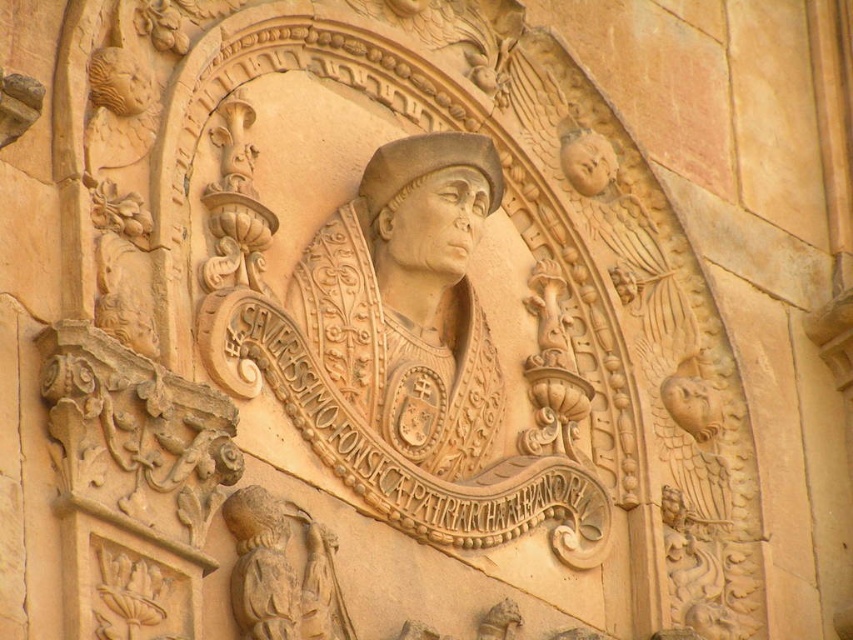
You are an art conservator working on a restoration project of the stone relief. You need to ensure that the distance between the matte stone head at center and the matte stone head at upper right is exactly 12 meters for structural integrity. Based on the current measurements, will adjustments be necessary?

The matte stone head at center and matte stone head at upper right are currently 11.54 meters apart. Since this is less than the required 12 meters, adjustments will be necessary to meet the structural integrity requirement.

In the scene shown: Based on the scene description, which object is larger in size between the matte stone head at center and the beige stone head at lower left?

The matte stone head at center is bigger than the beige stone head at lower left according to the description.

You are an art conservator examining the stone relief. You notice two stone heads in the carving. The beige stone head at lower left and the matte stone head at upper right. Which one is shorter in height?

The beige stone head at lower left has a lesser height compared to matte stone head at upper right, so the beige stone head at lower left is shorter in height.